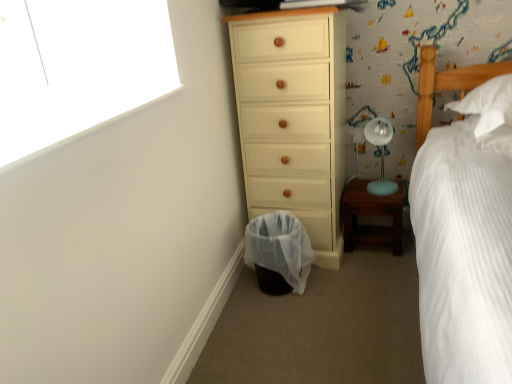
What do you see at coordinates (293, 117) in the screenshot? I see `matte cream chest of drawers at center` at bounding box center [293, 117].

What is the approximate height of wooden nightstand at lower right?

It is 11.15 inches.

This screenshot has height=384, width=512. I want to click on white textured bed at right, so click(x=447, y=85).

From a real-world perspective, between white textured bed at right and light blue plastic table lamp at right, who is vertically higher?

light blue plastic table lamp at right.

Is white textured bed at right bigger or smaller than light blue plastic table lamp at right?

white textured bed at right is bigger than light blue plastic table lamp at right.

Considering the sizes of objects white textured bed at right and light blue plastic table lamp at right in the image provided, who is thinner, white textured bed at right or light blue plastic table lamp at right?

light blue plastic table lamp at right is thinner.

Between white textured bed at right and light blue plastic table lamp at right, which one appears on the right side from the viewer's perspective?

From the viewer's perspective, white textured bed at right appears more on the right side.

Is translucent plastic laundry basket at lower center at the back of light blue plastic table lamp at right?

No, light blue plastic table lamp at right is not facing the opposite direction of translucent plastic laundry basket at lower center.

Considering the positions of point (382, 172) and point (290, 237), is point (382, 172) closer or farther from the camera than point (290, 237)?

Point (382, 172) is positioned farther from the camera compared to point (290, 237).

Is light blue plastic table lamp at right not inside translucent plastic laundry basket at lower center?

Yes, light blue plastic table lamp at right is located beyond the bounds of translucent plastic laundry basket at lower center.

Based on the photo, which of these two, light blue plastic table lamp at right or translucent plastic laundry basket at lower center, is thinner?

light blue plastic table lamp at right.

Between translucent plastic laundry basket at lower center and wooden nightstand at lower right, which one has smaller width?

wooden nightstand at lower right is thinner.

Is translucent plastic laundry basket at lower center positioned with its back to wooden nightstand at lower right?

No, wooden nightstand at lower right is not at the back of translucent plastic laundry basket at lower center.

Is translucent plastic laundry basket at lower center further to camera compared to wooden nightstand at lower right?

No, it is not.

From the image's perspective, is translucent plastic laundry basket at lower center above or below wooden nightstand at lower right?

translucent plastic laundry basket at lower center is situated lower than wooden nightstand at lower right in the image.

Is white textured bed at right positioned beyond the bounds of translucent plastic laundry basket at lower center?

Yes.

Who is smaller, white textured bed at right or translucent plastic laundry basket at lower center?

translucent plastic laundry basket at lower center is smaller.

Does white textured bed at right have a greater height compared to translucent plastic laundry basket at lower center?

Yes, white textured bed at right is taller than translucent plastic laundry basket at lower center.

Which object is wider, white textured bed at right or translucent plastic laundry basket at lower center?

white textured bed at right is wider.

Is light blue plastic table lamp at right not near white textured bed at right?

No, light blue plastic table lamp at right is not far from white textured bed at right.

From the image's perspective, is light blue plastic table lamp at right located above or below white textured bed at right?

light blue plastic table lamp at right is situated higher than white textured bed at right in the image.

From a real-world perspective, is light blue plastic table lamp at right over white textured bed at right?

Yes.

Is white textured bed at right positioned far away from wooden nightstand at lower right?

That's not correct — white textured bed at right is a little close to wooden nightstand at lower right.

Which is more to the left, white textured bed at right or wooden nightstand at lower right?

Result: wooden nightstand at lower right is more to the left.

Is wooden nightstand at lower right to the right of matte cream chest of drawers at center from the viewer's perspective?

Correct, you'll find wooden nightstand at lower right to the right of matte cream chest of drawers at center.

Could you tell me if wooden nightstand at lower right is facing matte cream chest of drawers at center?

No.

Find the location of a particular element. The width and height of the screenshot is (512, 384). chest of drawers that appears on the left of wooden nightstand at lower right is located at coordinates (x=293, y=117).

Which of these two, wooden nightstand at lower right or matte cream chest of drawers at center, stands taller?

matte cream chest of drawers at center.

Identify the location of table lamp above the white textured bed at right (from the image's perspective). (381, 153).

Where is `table lamp above the translucent plastic laundry basket at lower center (from a real-world perspective)`? table lamp above the translucent plastic laundry basket at lower center (from a real-world perspective) is located at coordinates (381, 153).

Which object lies further to the anchor point wooden nightstand at lower right, translucent plastic laundry basket at lower center or matte cream chest of drawers at center?

translucent plastic laundry basket at lower center is further to wooden nightstand at lower right.

From the image, which object appears to be farther from light blue plastic table lamp at right, translucent plastic laundry basket at lower center or white textured bed at right?

translucent plastic laundry basket at lower center lies further to light blue plastic table lamp at right than the other object.

From the picture: Considering their positions, is matte cream chest of drawers at center positioned further to wooden nightstand at lower right than light blue plastic table lamp at right?

matte cream chest of drawers at center.

From the image, which object appears to be nearer to light blue plastic table lamp at right, wooden nightstand at lower right or translucent plastic laundry basket at lower center?

wooden nightstand at lower right.

Which object lies nearer to the anchor point translucent plastic laundry basket at lower center, wooden nightstand at lower right or white textured bed at right?

The object closer to translucent plastic laundry basket at lower center is wooden nightstand at lower right.

When comparing their distances from matte cream chest of drawers at center, does translucent plastic laundry basket at lower center or light blue plastic table lamp at right seem further?

light blue plastic table lamp at right.

Which object lies nearer to the anchor point white textured bed at right, wooden nightstand at lower right or translucent plastic laundry basket at lower center?

Among the two, wooden nightstand at lower right is located nearer to white textured bed at right.

Estimate the real-world distances between objects in this image. Which object is further from white textured bed at right, matte cream chest of drawers at center or translucent plastic laundry basket at lower center?

translucent plastic laundry basket at lower center is positioned further to the anchor white textured bed at right.

Where is `table lamp situated between translucent plastic laundry basket at lower center and wooden nightstand at lower right from left to right`? This screenshot has height=384, width=512. table lamp situated between translucent plastic laundry basket at lower center and wooden nightstand at lower right from left to right is located at coordinates (381, 153).

Locate an element on the screen. chest of drawers between white textured bed at right and wooden nightstand at lower right along the z-axis is located at coordinates (293, 117).

Locate an element on the screen. This screenshot has height=384, width=512. table lamp between white textured bed at right and wooden nightstand at lower right from front to back is located at coordinates (381, 153).

Identify the location of chest of drawers between white textured bed at right and light blue plastic table lamp at right along the z-axis. (293, 117).